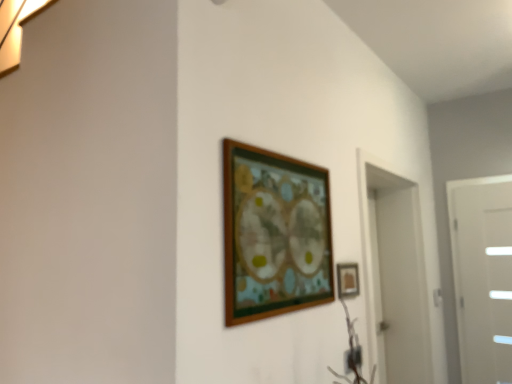
What do you see at coordinates (274, 234) in the screenshot? This screenshot has width=512, height=384. I see `wooden picture frame at center, marked as the second picture frame in a right-to-left arrangement` at bounding box center [274, 234].

Locate an element on the screen. The height and width of the screenshot is (384, 512). wooden picture frame at center, which appears as the second picture frame when viewed from the back is located at coordinates (274, 234).

Image resolution: width=512 pixels, height=384 pixels. Describe the element at coordinates (347, 280) in the screenshot. I see `matte gold picture frame at center-right, marked as the second picture frame in a front-to-back arrangement` at that location.

This screenshot has height=384, width=512. I want to click on wooden picture frame at center, marked as the second picture frame in a right-to-left arrangement, so click(274, 234).

Considering the sizes of objects wooden picture frame at center, which appears as the second picture frame when viewed from the back, and white glossy door at right in the image provided, who is bigger, wooden picture frame at center, which appears as the second picture frame when viewed from the back, or white glossy door at right?

Bigger between the two is white glossy door at right.

Which object is closer to the camera, wooden picture frame at center, the 1th picture frame in the left-to-right sequence, or white glossy door at right?

wooden picture frame at center, the 1th picture frame in the left-to-right sequence, is in front.

Can you tell me how much wooden picture frame at center, the 1th picture frame in the left-to-right sequence, and white glossy door at right differ in facing direction?

There is a 113-degree angle between the facing directions of wooden picture frame at center, the 1th picture frame in the left-to-right sequence, and white glossy door at right.

Is wooden picture frame at center, which appears as the second picture frame when viewed from the back, aimed at white glossy door at right?

No, wooden picture frame at center, which appears as the second picture frame when viewed from the back, is not aimed at white glossy door at right.

Does matte gold picture frame at center-right, acting as the first picture frame starting from the right, lie behind white glossy door at right?

No, it is not.

From the image's perspective, is matte gold picture frame at center-right, marked as the second picture frame in a front-to-back arrangement, located above or below white glossy door at right?

Clearly, from the image's perspective, matte gold picture frame at center-right, marked as the second picture frame in a front-to-back arrangement, is above white glossy door at right.

Is matte gold picture frame at center-right, marked as the second picture frame in a front-to-back arrangement, turned away from white glossy door at right?

No.

This screenshot has height=384, width=512. I want to click on picture frame that is the 1st one when counting forward from the white glossy door at right, so click(347, 280).

Are wooden picture frame at center, the 1th picture frame in the left-to-right sequence, and matte gold picture frame at center-right, marked as the second picture frame in a front-to-back arrangement, making contact?

wooden picture frame at center, the 1th picture frame in the left-to-right sequence, and matte gold picture frame at center-right, marked as the second picture frame in a front-to-back arrangement, are clearly separated.

From the image's perspective, is wooden picture frame at center, the 1th picture frame in the left-to-right sequence, below matte gold picture frame at center-right, the second picture frame from the left?

No.

Can you tell me how much wooden picture frame at center, which appears as the first picture frame when viewed from the front, and matte gold picture frame at center-right, the second picture frame from the left, differ in facing direction?

The angle between the facing direction of wooden picture frame at center, which appears as the first picture frame when viewed from the front, and the facing direction of matte gold picture frame at center-right, the second picture frame from the left, is 0.135 degrees.

From a real-world perspective, which is physically above, wooden picture frame at center, which appears as the first picture frame when viewed from the front, or matte gold picture frame at center-right, positioned as the 1th picture frame in back-to-front order?

In real-world perspective, wooden picture frame at center, which appears as the first picture frame when viewed from the front, is above.

Considering the sizes of white glossy door at right and wooden picture frame at center, which appears as the second picture frame when viewed from the back, in the image, is white glossy door at right bigger or smaller than wooden picture frame at center, which appears as the second picture frame when viewed from the back,?

In the image, white glossy door at right appears to be larger than wooden picture frame at center, which appears as the second picture frame when viewed from the back.

Consider the image. Is white glossy door at right located outside wooden picture frame at center, which appears as the first picture frame when viewed from the front?

white glossy door at right is positioned outside wooden picture frame at center, which appears as the first picture frame when viewed from the front.

Does white glossy door at right have a greater height compared to wooden picture frame at center, which appears as the second picture frame when viewed from the back?

Yes.

Is matte gold picture frame at center-right, marked as the second picture frame in a front-to-back arrangement, bigger or smaller than wooden picture frame at center, which appears as the first picture frame when viewed from the front?

Clearly, matte gold picture frame at center-right, marked as the second picture frame in a front-to-back arrangement, is smaller in size than wooden picture frame at center, which appears as the first picture frame when viewed from the front.

In the image, is matte gold picture frame at center-right, marked as the second picture frame in a front-to-back arrangement, positioned in front of or behind wooden picture frame at center, marked as the second picture frame in a right-to-left arrangement?

Visually, matte gold picture frame at center-right, marked as the second picture frame in a front-to-back arrangement, is located behind wooden picture frame at center, marked as the second picture frame in a right-to-left arrangement.

Based on the photo, from a real-world perspective, is matte gold picture frame at center-right, positioned as the 1th picture frame in back-to-front order, physically below wooden picture frame at center, which appears as the first picture frame when viewed from the front?

Correct, in the physical world, matte gold picture frame at center-right, positioned as the 1th picture frame in back-to-front order, is lower than wooden picture frame at center, which appears as the first picture frame when viewed from the front.

Locate an element on the screen. The height and width of the screenshot is (384, 512). picture frame located above the matte gold picture frame at center-right, the second picture frame from the left (from a real-world perspective) is located at coordinates (274, 234).

In the image, is white glossy door at right positioned in front of or behind matte gold picture frame at center-right, acting as the first picture frame starting from the right?

white glossy door at right is behind matte gold picture frame at center-right, acting as the first picture frame starting from the right.

Is the surface of white glossy door at right in direct contact with matte gold picture frame at center-right, marked as the second picture frame in a front-to-back arrangement?

white glossy door at right and matte gold picture frame at center-right, marked as the second picture frame in a front-to-back arrangement, are not in contact.

Considering the positions of objects white glossy door at right and matte gold picture frame at center-right, the second picture frame from the left, in the image provided, who is more to the right, white glossy door at right or matte gold picture frame at center-right, the second picture frame from the left,?

white glossy door at right.

You are a GUI agent. You are given a task and a screenshot of the screen. Output one action in this format:
    pyautogui.click(x=<x>, y=<y>)
    Task: Click on the door on the right of wooden picture frame at center, the 1th picture frame in the left-to-right sequence
    
    Given the screenshot: What is the action you would take?
    pyautogui.click(x=483, y=276)

This screenshot has width=512, height=384. I want to click on the 1st picture frame positioned above the white glossy door at right (from the image's perspective), so click(347, 280).

When comparing their distances from wooden picture frame at center, which appears as the second picture frame when viewed from the back, does matte gold picture frame at center-right, acting as the first picture frame starting from the right, or white glossy door at right seem closer?

matte gold picture frame at center-right, acting as the first picture frame starting from the right, is closer to wooden picture frame at center, which appears as the second picture frame when viewed from the back.

Looking at this image, based on their spatial positions, is wooden picture frame at center, marked as the second picture frame in a right-to-left arrangement, or matte gold picture frame at center-right, the second picture frame from the left, closer to white glossy door at right?

Based on the image, matte gold picture frame at center-right, the second picture frame from the left, appears to be nearer to white glossy door at right.

Considering their positions, is matte gold picture frame at center-right, acting as the first picture frame starting from the right, positioned closer to white glossy door at right than wooden picture frame at center, which appears as the first picture frame when viewed from the front?

matte gold picture frame at center-right, acting as the first picture frame starting from the right, is positioned closer to the anchor white glossy door at right.

Looking at the image, which one is located closer to matte gold picture frame at center-right, the second picture frame from the left, wooden picture frame at center, the 1th picture frame in the left-to-right sequence, or white glossy door at right?

wooden picture frame at center, the 1th picture frame in the left-to-right sequence, lies closer to matte gold picture frame at center-right, the second picture frame from the left, than the other object.

Consider the image. Looking at the image, which one is located further to matte gold picture frame at center-right, marked as the second picture frame in a front-to-back arrangement, white glossy door at right or wooden picture frame at center, which appears as the first picture frame when viewed from the front?

Based on the image, white glossy door at right appears to be further to matte gold picture frame at center-right, marked as the second picture frame in a front-to-back arrangement.

Looking at the image, which one is located further to wooden picture frame at center, the 1th picture frame in the left-to-right sequence, white glossy door at right or matte gold picture frame at center-right, positioned as the 1th picture frame in back-to-front order?

Among the two, white glossy door at right is located further to wooden picture frame at center, the 1th picture frame in the left-to-right sequence.

In order to click on picture frame between wooden picture frame at center, the 1th picture frame in the left-to-right sequence, and white glossy door at right, in the horizontal direction in this screenshot , I will do `click(347, 280)`.